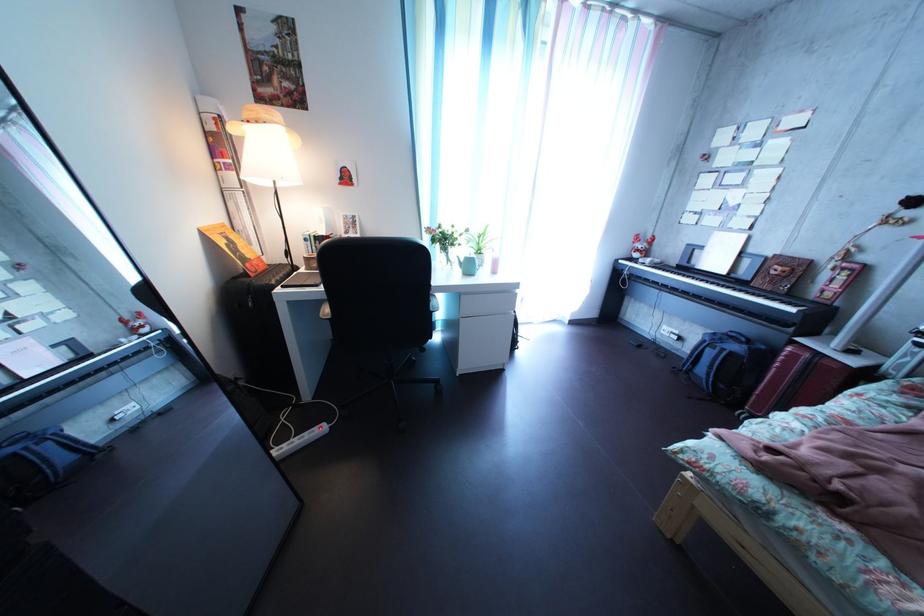
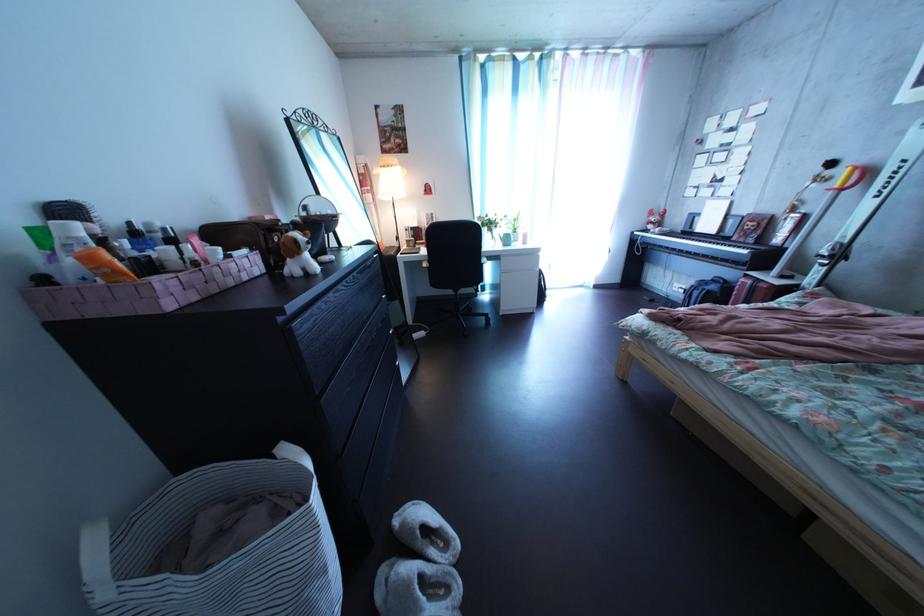
Question: What movement of the cameraman would produce the second image?

Choices:
 (A) Left
 (B) Right
 (C) Forward
 (D) Backward

Answer: (D)